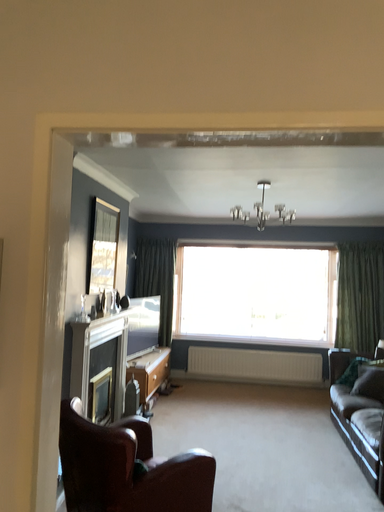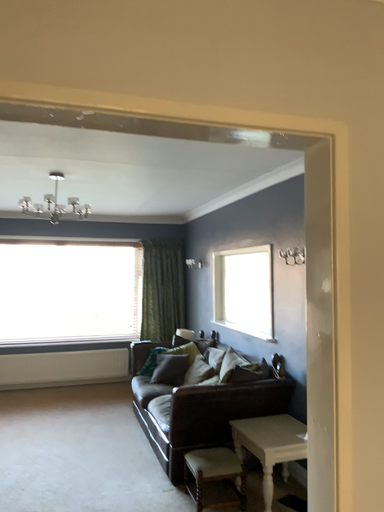
Question: Which way did the camera rotate in the video?

Choices:
 (A) rotated left
 (B) rotated right

Answer: (B)